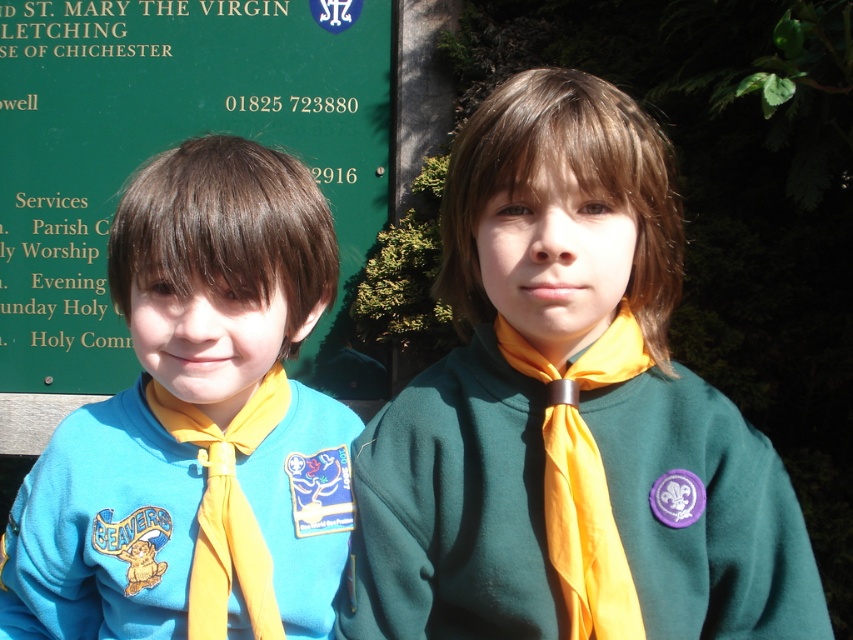
You are a scout leader trying to distribute pins to scouts. You have a limited number of pins that can only be attached to clothing items that are larger than 10 cm in size. Looking at the image, can you determine if the green fleece sweater at center or the yellow satin tie at center will qualify for receiving the pins?

The green fleece sweater at center is bigger than yellow satin tie at center. Since the requirement is for clothing items larger than 10 cm, and the sweater is larger than the tie, the green fleece sweater at center qualifies for receiving the pins.

You are a photographer taking a picture of the two boys in front of the green signboard. You notice the yellow silky necktie at center is partially blocking the view of the green signboard at upper left. To ensure the signboard is fully visible, which object should you adjust and in what direction?

You should adjust the yellow silky necktie at center to the right to allow the green signboard at upper left to become fully visible.